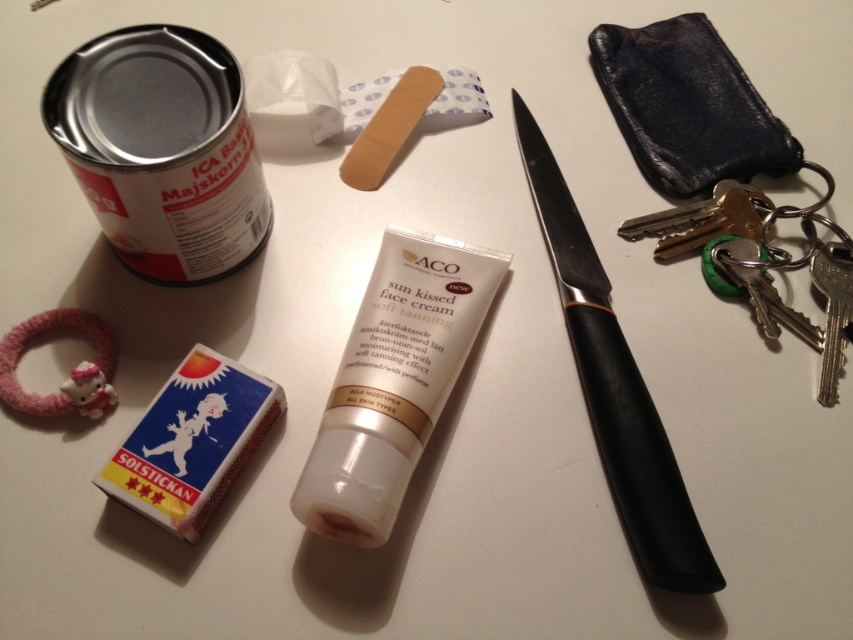
You are organizing items on a shelf and need to place the silver metallic can at upper left and the blue cardboard matchbox at lower left. According to their positions in the image, which item should be placed to the left of the other?

The silver metallic can at upper left should be placed to the left of the blue cardboard matchbox at lower left because it is positioned on the left side of the blue cardboard matchbox at lower left in the image.

You are organizing items on a shelf and need to place the silver metallic can at upper left and the black plastic knife at upper right. The shelf has a maximum length of 50 centimeters. Will both items fit side by side on the shelf without overlapping?

The silver metallic can at upper left is 54.34 centimeters away from the black plastic knife at upper right, which exceeds the shelf length of 50 centimeters. Therefore, they cannot fit side by side without overlapping.